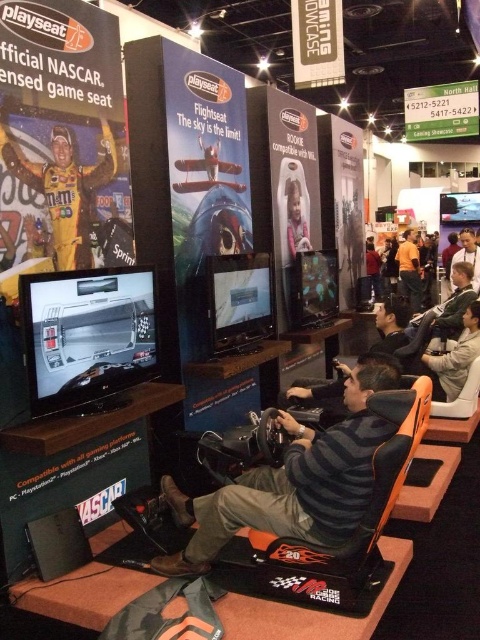
Question: In this image, where is orange fabric racing seat at center located relative to matte yellow racing suit at upper left?

Choices:
 (A) below
 (B) above

Answer: (A)

Question: Which point is closer to the camera?

Choices:
 (A) orange fabric racing seat at center
 (B) matte black racing seat at center
 (C) matte yellow racing suit at upper left

Answer: (A)

Question: Where is orange fabric racing seat at center located in relation to matte yellow racing suit at upper left in the image?

Choices:
 (A) right
 (B) left

Answer: (A)

Question: Among these objects, which one is nearest to the camera?

Choices:
 (A) matte yellow racing suit at upper left
 (B) orange fabric racing seat at center

Answer: (B)

Question: Does orange fabric racing seat at center come behind matte yellow racing suit at upper left?

Choices:
 (A) no
 (B) yes

Answer: (A)

Question: Considering the real-world distances, which object is closest to the matte black racing seat at center?

Choices:
 (A) matte yellow racing suit at upper left
 (B) orange fabric racing seat at center

Answer: (B)